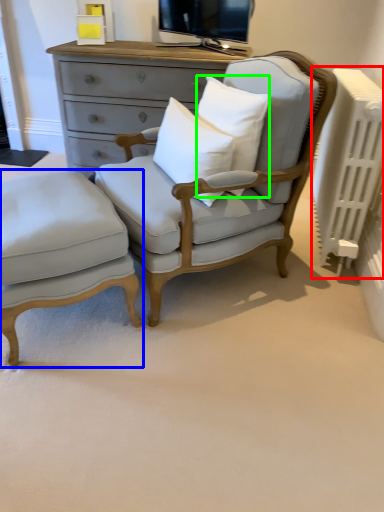
Question: Considering the real-world distances, which object is closest to radiator (highlighted by a red box)? nightstand (highlighted by a blue box) or pillow (highlighted by a green box).

Choices:
 (A) nightstand
 (B) pillow

Answer: (B)